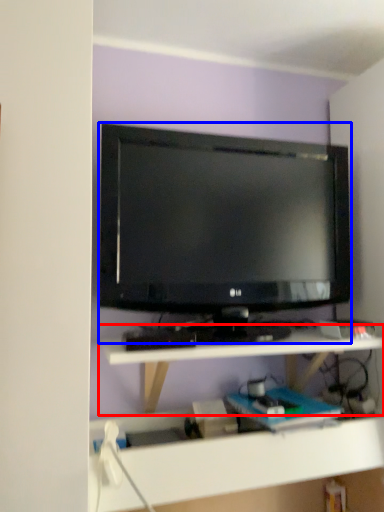
Question: Which object appears closest to the camera in this image, shelf (highlighted by a red box) or television (highlighted by a blue box)?

Choices:
 (A) shelf
 (B) television

Answer: (A)